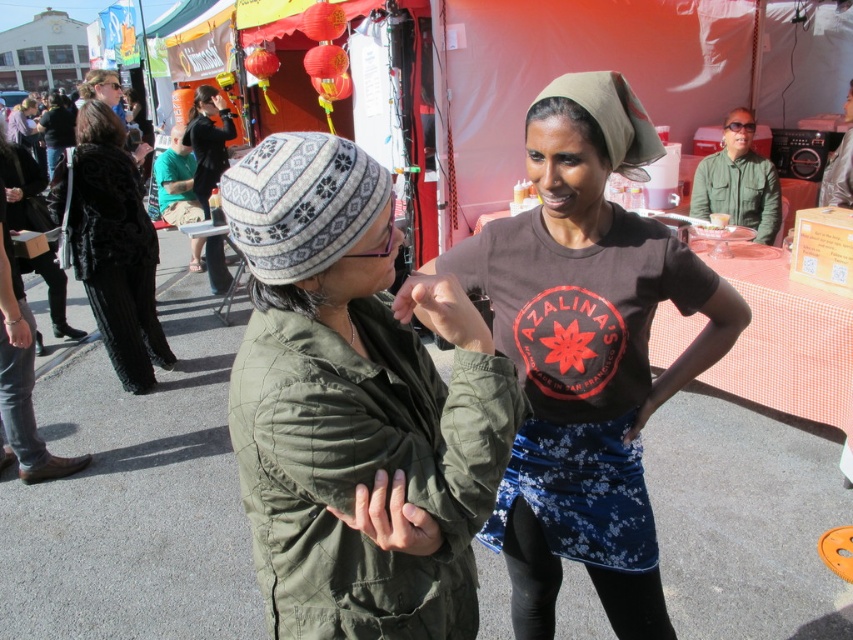
Question: Which point is farther to the camera?

Choices:
 (A) black fur coat at left
 (B) matte brown t-shirt at center

Answer: (A)

Question: Among these objects, which one is farthest from the camera?

Choices:
 (A) matte brown t-shirt at center
 (B) black fur coat at left

Answer: (B)

Question: Is knitted woolen hat at center to the right of matte brown t-shirt at center from the viewer's perspective?

Choices:
 (A) no
 (B) yes

Answer: (A)

Question: Does knitted woolen hat at center appear on the left side of matte brown t-shirt at center?

Choices:
 (A) yes
 (B) no

Answer: (A)

Question: Among these objects, which one is farthest from the camera?

Choices:
 (A) knitted woolen hat at center
 (B) matte brown t-shirt at center
 (C) black fur coat at left

Answer: (C)

Question: Is matte brown t-shirt at center to the right of black fur coat at left from the viewer's perspective?

Choices:
 (A) yes
 (B) no

Answer: (A)